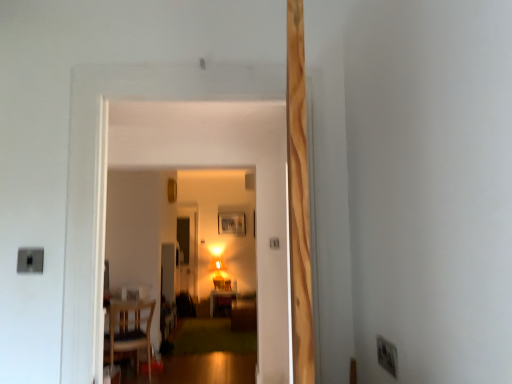
Find the location of a particular element. The image size is (512, 384). wooden picture frame at center is located at coordinates (232, 223).

What do you see at coordinates (232, 223) in the screenshot? This screenshot has height=384, width=512. I see `wooden picture frame at center` at bounding box center [232, 223].

At what (x,y) coordinates should I click in order to perform the action: click on wooden chair at lower left. Please return your answer as a coordinate pair (x, y). The width and height of the screenshot is (512, 384). Looking at the image, I should click on pos(128,331).

Where is `white plastic electric outlet at lower right`? The height and width of the screenshot is (384, 512). white plastic electric outlet at lower right is located at coordinates (387, 356).

I want to click on wooden picture frame at center, so click(x=232, y=223).

Can white plastic electric outlet at lower right be found inside wooden chair at lower left?

No, white plastic electric outlet at lower right is located outside of wooden chair at lower left.

Which object is further away from the camera taking this photo, wooden chair at lower left or white plastic electric outlet at lower right?

wooden chair at lower left is behind.

Considering the sizes of wooden chair at lower left and white plastic electric outlet at lower right in the image, is wooden chair at lower left wider or thinner than white plastic electric outlet at lower right?

Considering their sizes, wooden chair at lower left looks broader than white plastic electric outlet at lower right.

Would you say wooden chair at lower left is to the left or to the right of white plastic electric outlet at lower right in the picture?

Clearly, wooden chair at lower left is on the left of white plastic electric outlet at lower right in the image.

Is matte wooden table at center looking in the opposite direction of wooden picture frame at center?

matte wooden table at center is not turned away from wooden picture frame at center.

Which is behind, point (214, 309) or point (238, 229)?

The point (238, 229) is farther.

From the image's perspective, would you say matte wooden table at center is shown under wooden picture frame at center?

Indeed, from the image's perspective, matte wooden table at center is shown beneath wooden picture frame at center.

From a real-world perspective, is matte wooden table at center positioned above or below wooden picture frame at center?

Clearly, from a real-world perspective, matte wooden table at center is below wooden picture frame at center.

Is point (379, 360) closer to viewer compared to point (231, 215)?

Yes, it is.

Can you confirm if white plastic electric outlet at lower right is smaller than wooden picture frame at center?

Indeed, white plastic electric outlet at lower right has a smaller size compared to wooden picture frame at center.

From the image's perspective, is white plastic electric outlet at lower right located above or below wooden picture frame at center?

From the image's perspective, white plastic electric outlet at lower right appears above wooden picture frame at center.

From a real-world perspective, between white plastic electric outlet at lower right and wooden picture frame at center, who is vertically higher?

In real-world perspective, wooden picture frame at center is above.

Considering the relative positions of wooden chair at lower left and matte wooden table at center in the image provided, is wooden chair at lower left to the right of matte wooden table at center from the viewer's perspective?

No.

Which is correct: wooden chair at lower left is inside matte wooden table at center, or outside of it?

wooden chair at lower left lies outside matte wooden table at center.

Locate an element on the screen. This screenshot has width=512, height=384. table that appears on the right of wooden chair at lower left is located at coordinates (221, 302).

From the image's perspective, relative to wooden chair at lower left, is wooden picture frame at center above or below?

wooden picture frame at center is situated higher than wooden chair at lower left in the image.

Measure the distance from wooden picture frame at center to wooden chair at lower left.

A distance of 13.82 feet exists between wooden picture frame at center and wooden chair at lower left.

Is there a large distance between wooden picture frame at center and wooden chair at lower left?

Yes.

Which object is further away from the camera taking this photo, wooden picture frame at center or wooden chair at lower left?

Positioned behind is wooden picture frame at center.

Which object is wider, wooden picture frame at center or white plastic electric outlet at lower right?

wooden picture frame at center is wider.

Between point (219, 227) and point (392, 358), which one is positioned in front?

Point (392, 358)

Could white plastic electric outlet at lower right be considered to be inside wooden picture frame at center?

No, white plastic electric outlet at lower right is not a part of wooden picture frame at center.

Is white plastic electric outlet at lower right inside the boundaries of wooden chair at lower left, or outside?

white plastic electric outlet at lower right is outside wooden chair at lower left.

From a real-world perspective, is white plastic electric outlet at lower right physically above wooden chair at lower left?

Yes, from a real-world perspective, white plastic electric outlet at lower right is over wooden chair at lower left

Consider the image. From the image's perspective, which object appears higher, white plastic electric outlet at lower right or wooden chair at lower left?

white plastic electric outlet at lower right.

From the picture: Relative to wooden chair at lower left, is white plastic electric outlet at lower right in front or behind?

Visually, white plastic electric outlet at lower right is located in front of wooden chair at lower left.

Identify the location of chair behind the white plastic electric outlet at lower right. (128, 331).

This screenshot has width=512, height=384. I want to click on table below the wooden picture frame at center (from a real-world perspective), so click(x=221, y=302).

From the image, which object appears to be nearer to wooden picture frame at center, white plastic electric outlet at lower right or wooden chair at lower left?

Among the two, wooden chair at lower left is located nearer to wooden picture frame at center.

Considering their positions, is matte wooden table at center positioned further to wooden picture frame at center than white plastic electric outlet at lower right?

white plastic electric outlet at lower right is positioned further to the anchor wooden picture frame at center.

Which object lies nearer to the anchor point white plastic electric outlet at lower right, wooden picture frame at center or matte wooden table at center?

matte wooden table at center is positioned closer to the anchor white plastic electric outlet at lower right.

From the image, which object appears to be farther from wooden chair at lower left, wooden picture frame at center or matte wooden table at center?

wooden picture frame at center is positioned further to the anchor wooden chair at lower left.

Based on their spatial positions, is wooden chair at lower left or wooden picture frame at center further from white plastic electric outlet at lower right?

wooden picture frame at center lies further to white plastic electric outlet at lower right than the other object.

Which object lies further to the anchor point wooden chair at lower left, white plastic electric outlet at lower right or wooden picture frame at center?

wooden picture frame at center.

Estimate the real-world distances between objects in this image. Which object is closer to white plastic electric outlet at lower right, wooden picture frame at center or wooden chair at lower left?

wooden chair at lower left is closer to white plastic electric outlet at lower right.

Considering their positions, is wooden picture frame at center positioned closer to wooden chair at lower left than white plastic electric outlet at lower right?

white plastic electric outlet at lower right is closer to wooden chair at lower left.

The width and height of the screenshot is (512, 384). In order to click on table positioned between white plastic electric outlet at lower right and wooden picture frame at center from near to far in this screenshot , I will do `click(221, 302)`.

The height and width of the screenshot is (384, 512). Find the location of `chair between white plastic electric outlet at lower right and matte wooden table at center from front to back`. chair between white plastic electric outlet at lower right and matte wooden table at center from front to back is located at coordinates (128, 331).

Find the location of a particular element. chair located between white plastic electric outlet at lower right and wooden picture frame at center in the depth direction is located at coordinates (128, 331).

This screenshot has height=384, width=512. Identify the location of table between wooden chair at lower left and wooden picture frame at center in the front-back direction. (221, 302).